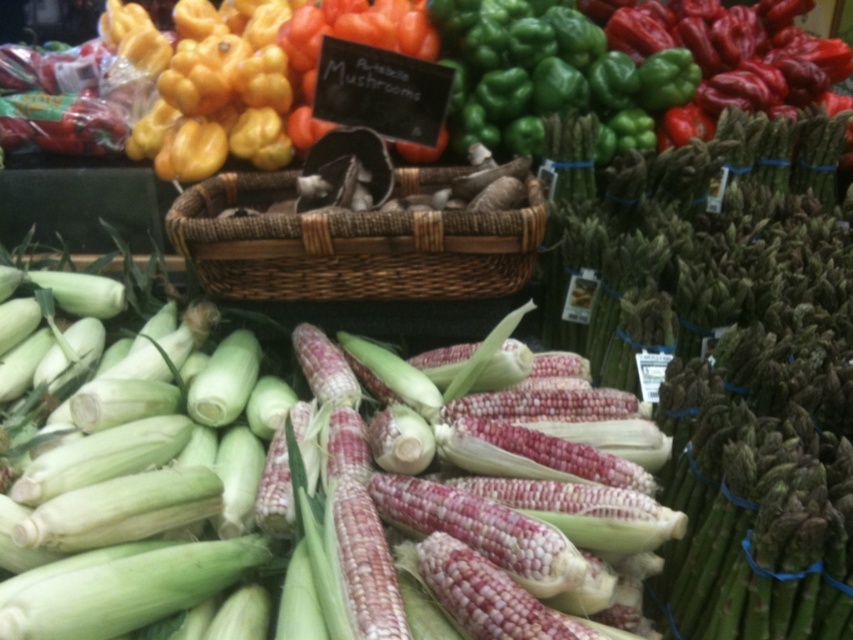
You are a customer at the market stall. You want to pick up the green matte corn at center but notice a woven brown basket at center is in the way. Can you reach the corn without moving the basket?

The green matte corn at center is positioned under the woven brown basket at center, so you can reach it by moving the basket aside or lifting it to access the corn beneath.

You are a customer at the market stall and want to buy both the green matte corn at center and the woven brown basket at center. However, you have a height restriction of 30 cm for carrying items. Can you determine if both items can fit in your bag based on their heights?

The green matte corn at center is much taller than the woven brown basket at center. Since the corn is taller and the height restriction is 30 cm, it might exceed the limit. Check the corn height first.

You are a customer at the market stall and want to pick up the green matte corn at center. Can you reach it without moving the woven brown basket at center?

The green matte corn at center is in front of the woven brown basket at center, so you can reach it without moving the basket.